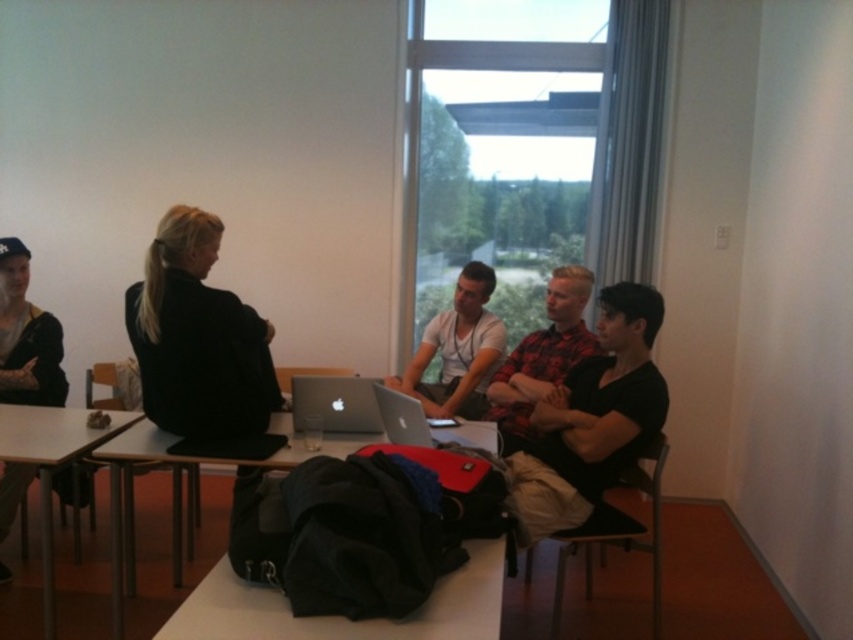
Measure the distance between point (x=485, y=288) and camera.

They are 11.90 feet apart.

Can you confirm if matte white shirt at center is positioned to the left of satin silver laptop at center?

No, matte white shirt at center is not to the left of satin silver laptop at center.

Is point (471, 356) less distant than point (357, 378)?

No, it is not.

Find the location of a particular element. This screenshot has height=640, width=853. matte white shirt at center is located at coordinates (457, 349).

Can you confirm if satin silver laptop at center is positioned to the right of silver metallic laptop at center?

No, satin silver laptop at center is not to the right of silver metallic laptop at center.

Is point (292, 420) farther from camera compared to point (379, 406)?

Yes, it is behind point (379, 406).

Is point (294, 412) positioned in front of point (463, 436)?

Yes.

This screenshot has width=853, height=640. I want to click on satin silver laptop at center, so click(335, 403).

Does black matte jacket at left have a greater width compared to black fabric bag at lower center?

No.

The width and height of the screenshot is (853, 640). What do you see at coordinates (198, 339) in the screenshot?
I see `black matte jacket at left` at bounding box center [198, 339].

Does point (136, 314) come farther from viewer compared to point (115, 621)?

Yes, it is behind point (115, 621).

Find the location of a particular element. black matte jacket at left is located at coordinates (198, 339).